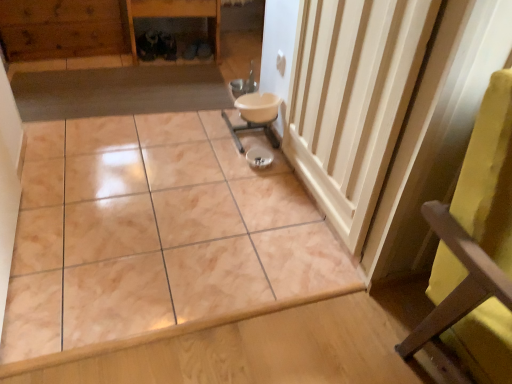
Question: Does white glossy sink at center have a lesser width compared to white wood radiator at center right?

Choices:
 (A) yes
 (B) no

Answer: (B)

Question: Is white glossy sink at center taller than white wood radiator at center right?

Choices:
 (A) yes
 (B) no

Answer: (B)

Question: Does white glossy sink at center have a lesser height compared to white wood radiator at center right?

Choices:
 (A) yes
 (B) no

Answer: (A)

Question: Does white glossy sink at center have a smaller size compared to white wood radiator at center right?

Choices:
 (A) no
 (B) yes

Answer: (B)

Question: Is white glossy sink at center wider than white wood radiator at center right?

Choices:
 (A) no
 (B) yes

Answer: (B)

Question: Is white glossy sink at center positioned with its back to white wood radiator at center right?

Choices:
 (A) yes
 (B) no

Answer: (B)

Question: Is wooden cabinet at upper left positioned in front of marble tile at center?

Choices:
 (A) no
 (B) yes

Answer: (A)

Question: Can you confirm if wooden cabinet at upper left is positioned to the left of marble tile at center?

Choices:
 (A) yes
 (B) no

Answer: (A)

Question: Could you tell me if wooden cabinet at upper left is turned towards marble tile at center?

Choices:
 (A) yes
 (B) no

Answer: (A)

Question: From a real-world perspective, is wooden cabinet at upper left on top of marble tile at center?

Choices:
 (A) no
 (B) yes

Answer: (B)

Question: Can we say wooden cabinet at upper left lies outside marble tile at center?

Choices:
 (A) yes
 (B) no

Answer: (A)

Question: Does wooden cabinet at upper left have a lesser width compared to marble tile at center?

Choices:
 (A) no
 (B) yes

Answer: (B)

Question: Would you consider wooden cabinet at upper left to be distant from white wood radiator at center right?

Choices:
 (A) no
 (B) yes

Answer: (B)